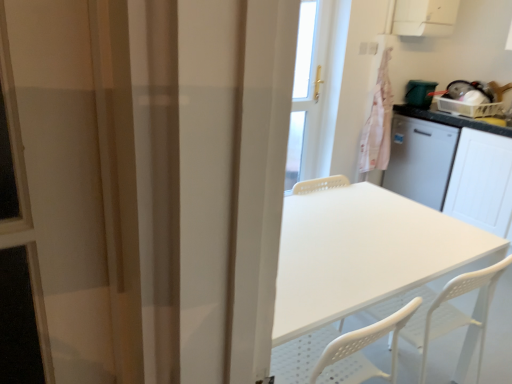
Question: Is white plastic exhaust hood at upper right a part of white plastic table at center?

Choices:
 (A) yes
 (B) no

Answer: (B)

Question: Does white plastic table at center lie behind white plastic exhaust hood at upper right?

Choices:
 (A) yes
 (B) no

Answer: (B)

Question: Considering the relative sizes of white plastic table at center and white plastic exhaust hood at upper right in the image provided, is white plastic table at center bigger than white plastic exhaust hood at upper right?

Choices:
 (A) no
 (B) yes

Answer: (B)

Question: Is white plastic table at center at the right side of white plastic exhaust hood at upper right?

Choices:
 (A) yes
 (B) no

Answer: (B)

Question: Is white plastic table at center to the left of white plastic exhaust hood at upper right from the viewer's perspective?

Choices:
 (A) no
 (B) yes

Answer: (B)

Question: Considering the relative positions of white plastic table at center and white plastic exhaust hood at upper right in the image provided, is white plastic table at center in front of white plastic exhaust hood at upper right?

Choices:
 (A) yes
 (B) no

Answer: (A)

Question: Is white matte cabinet at right smaller than pink fabric laundry at upper right?

Choices:
 (A) yes
 (B) no

Answer: (B)

Question: From the image's perspective, would you say white matte cabinet at right is shown under pink fabric laundry at upper right?

Choices:
 (A) yes
 (B) no

Answer: (A)

Question: Can you confirm if white matte cabinet at right is taller than pink fabric laundry at upper right?

Choices:
 (A) yes
 (B) no

Answer: (B)

Question: Does white matte cabinet at right come behind pink fabric laundry at upper right?

Choices:
 (A) no
 (B) yes

Answer: (A)

Question: Is white matte cabinet at right at the left side of pink fabric laundry at upper right?

Choices:
 (A) no
 (B) yes

Answer: (A)

Question: Is there a large distance between white matte cabinet at right and pink fabric laundry at upper right?

Choices:
 (A) yes
 (B) no

Answer: (B)

Question: From a real-world perspective, is white plastic exhaust hood at upper right located beneath white matte cabinet at right?

Choices:
 (A) no
 (B) yes

Answer: (A)